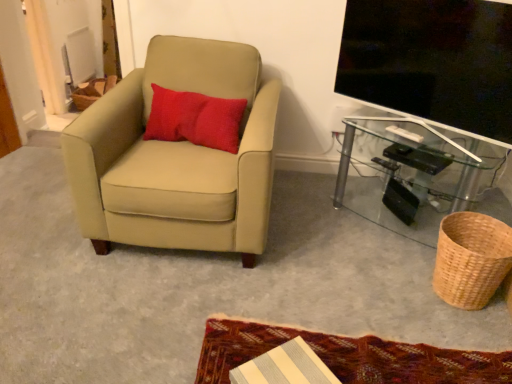
The width and height of the screenshot is (512, 384). What do you see at coordinates (195, 119) in the screenshot?
I see `red textured pillow at upper left` at bounding box center [195, 119].

What are the coordinates of `woven natural basket at lower right` in the screenshot? It's located at (471, 259).

What is the approximate width of woven natural basket at lower right?

12.62 inches.

The image size is (512, 384). I want to click on flat screen tv at upper right, so tap(432, 61).

Image resolution: width=512 pixels, height=384 pixels. Find the location of `red textured pillow at upper left`. red textured pillow at upper left is located at coordinates (195, 119).

Who is smaller, flat screen tv at upper right or suede beige armchair at left?

flat screen tv at upper right.

How many degrees apart are the facing directions of flat screen tv at upper right and suede beige armchair at left?

The angular difference between flat screen tv at upper right and suede beige armchair at left is 37.2 degrees.

Which is in front, point (509, 99) or point (224, 210)?

Positioned in front is point (509, 99).

From a real-world perspective, is flat screen tv at upper right over suede beige armchair at left?

Yes, from a real-world perspective, flat screen tv at upper right is over suede beige armchair at left

Can you confirm if flat screen tv at upper right is smaller than textured woolen mat at lower center?

Actually, flat screen tv at upper right might be larger than textured woolen mat at lower center.

Considering the positions of objects flat screen tv at upper right and textured woolen mat at lower center in the image provided, who is in front, flat screen tv at upper right or textured woolen mat at lower center?

textured woolen mat at lower center is more forward.

Is flat screen tv at upper right taller or shorter than textured woolen mat at lower center?

flat screen tv at upper right is taller than textured woolen mat at lower center.

Would you say textured woolen mat at lower center is part of flat screen tv at upper right's contents?

No.

Considering the sizes of suede beige armchair at left and flat screen tv at upper right in the image, is suede beige armchair at left wider or thinner than flat screen tv at upper right?

Clearly, suede beige armchair at left has more width compared to flat screen tv at upper right.

Is suede beige armchair at left next to flat screen tv at upper right and touching it?

No, suede beige armchair at left is not making contact with flat screen tv at upper right.

Between suede beige armchair at left and flat screen tv at upper right, which one has smaller size?

With smaller size is flat screen tv at upper right.

Is woven natural basket at lower right shorter than suede beige armchair at left?

Yes.

Could you tell me if woven natural basket at lower right is turned towards suede beige armchair at left?

Yes, woven natural basket at lower right is aimed at suede beige armchair at left.

Which of these two, woven natural basket at lower right or suede beige armchair at left, is wider?

Wider between the two is suede beige armchair at left.

What's the angular difference between woven natural basket at lower right and suede beige armchair at left's facing directions?

The angle between the facing direction of woven natural basket at lower right and the facing direction of suede beige armchair at left is 95.3 degrees.

Does suede beige armchair at left lie behind woven natural basket at lower right?

No, the depth of suede beige armchair at left is less than that of woven natural basket at lower right.

Can you confirm if suede beige armchair at left is bigger than woven natural basket at lower right?

Yes.

Looking at this image, in the image, is suede beige armchair at left on the left side or the right side of woven natural basket at lower right?

Clearly, suede beige armchair at left is on the left of woven natural basket at lower right in the image.

From the image's perspective, between suede beige armchair at left and woven natural basket at lower right, who is located below?

From the image's view, woven natural basket at lower right is below.

Which is farther, (x=499, y=153) or (x=447, y=69)?

Point (x=447, y=69)

This screenshot has height=384, width=512. What are the coordinates of `television that appears on the left of transparent glass table at lower right` in the screenshot? It's located at (432, 61).

Would you say transparent glass table at lower right is outside flat screen tv at upper right?

Yes, transparent glass table at lower right is not within flat screen tv at upper right.

From the image's perspective, which one is positioned higher, transparent glass table at lower right or flat screen tv at upper right?

From the image's view, flat screen tv at upper right is above.

Does transparent glass table at lower right have a greater height compared to red textured pillow at upper left?

Yes.

Is transparent glass table at lower right positioned beyond the bounds of red textured pillow at upper left?

Yes.

From a real-world perspective, does transparent glass table at lower right stand above red textured pillow at upper left?

No, from a real-world perspective, transparent glass table at lower right is not on top of red textured pillow at upper left.

At what (x,y) coordinates should I click in order to perform the action: click on television on the right side of suede beige armchair at left. Please return your answer as a coordinate pair (x, y). The width and height of the screenshot is (512, 384). Looking at the image, I should click on (432, 61).

The width and height of the screenshot is (512, 384). I want to click on mat that appears on the left of flat screen tv at upper right, so click(349, 356).

Looking at the image, which one is located further to flat screen tv at upper right, textured woolen mat at lower center or red textured pillow at upper left?

Based on the image, textured woolen mat at lower center appears to be further to flat screen tv at upper right.

Which object lies nearer to the anchor point suede beige armchair at left, transparent glass table at lower right or textured woolen mat at lower center?

textured woolen mat at lower center is positioned closer to the anchor suede beige armchair at left.

Estimate the real-world distances between objects in this image. Which object is closer to textured woolen mat at lower center, flat screen tv at upper right or red textured pillow at upper left?

red textured pillow at upper left lies closer to textured woolen mat at lower center than the other object.

Which object lies further to the anchor point woven natural basket at lower right, red textured pillow at upper left or textured woolen mat at lower center?

red textured pillow at upper left is positioned further to the anchor woven natural basket at lower right.

Looking at this image, from the image, which object appears to be nearer to woven natural basket at lower right, suede beige armchair at left or textured woolen mat at lower center?

textured woolen mat at lower center is closer to woven natural basket at lower right.

When comparing their distances from flat screen tv at upper right, does red textured pillow at upper left or transparent glass table at lower right seem closer?

Based on the image, transparent glass table at lower right appears to be nearer to flat screen tv at upper right.

Estimate the real-world distances between objects in this image. Which object is closer to transparent glass table at lower right, woven natural basket at lower right or red textured pillow at upper left?

woven natural basket at lower right is closer to transparent glass table at lower right.

Consider the image. From the image, which object appears to be nearer to suede beige armchair at left, red textured pillow at upper left or transparent glass table at lower right?

The object closer to suede beige armchair at left is red textured pillow at upper left.

I want to click on basket between transparent glass table at lower right and textured woolen mat at lower center from top to bottom, so click(471, 259).

The width and height of the screenshot is (512, 384). I want to click on table between red textured pillow at upper left and woven natural basket at lower right in the horizontal direction, so coord(416,176).

Find the location of a particular element. television between suede beige armchair at left and transparent glass table at lower right from left to right is located at coordinates (432, 61).

Locate an element on the screen. This screenshot has width=512, height=384. mat between red textured pillow at upper left and woven natural basket at lower right in the horizontal direction is located at coordinates (349, 356).